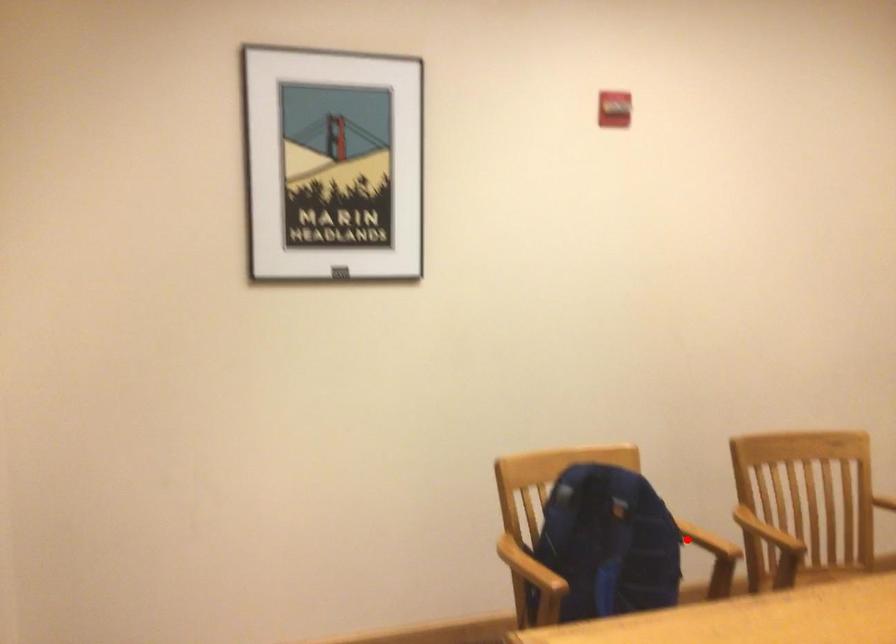
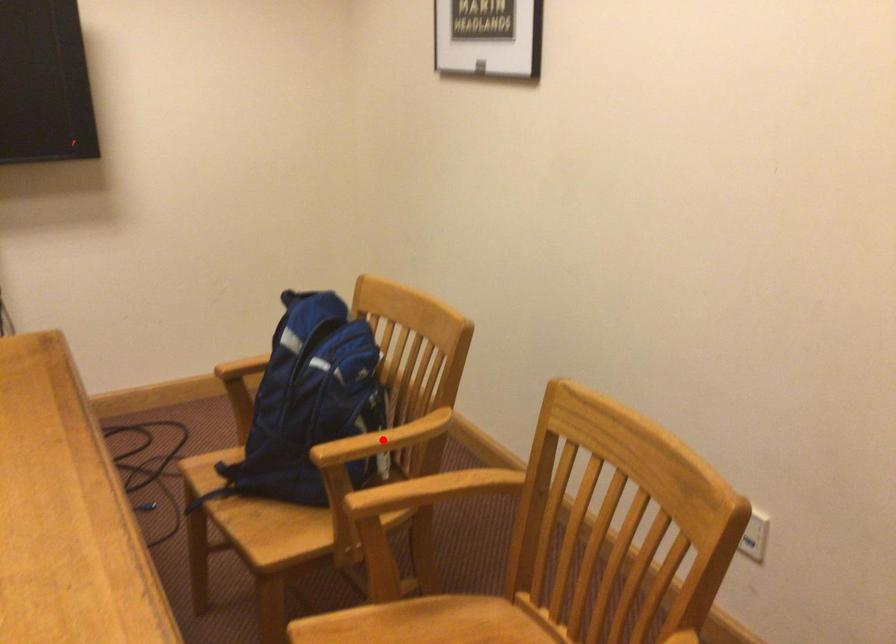
I am providing you with two images of the same scene from different viewpoints. A red point is marked on the first image and another point is marked on the second image. Are the points marked in image1 and image2 representing the same 3D position?

Yes